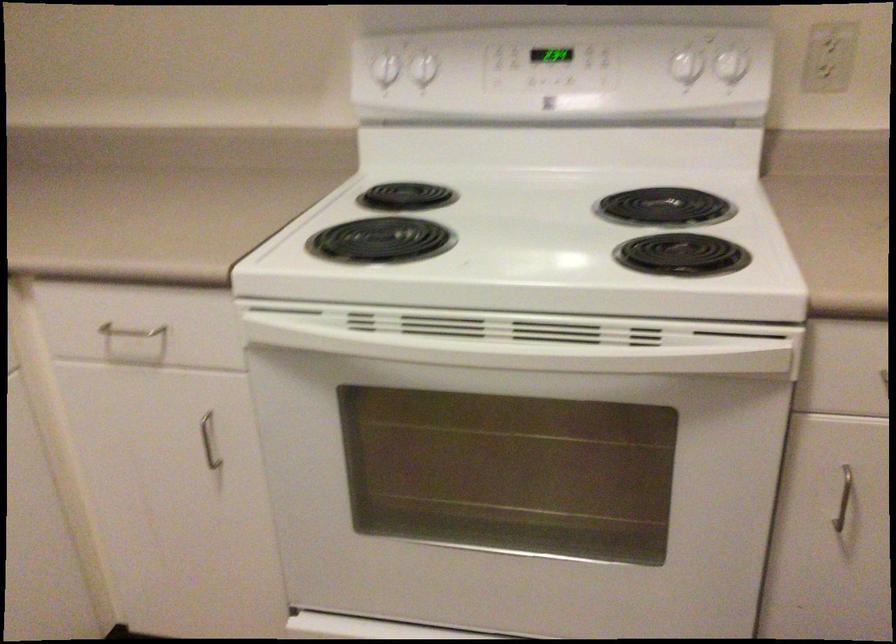
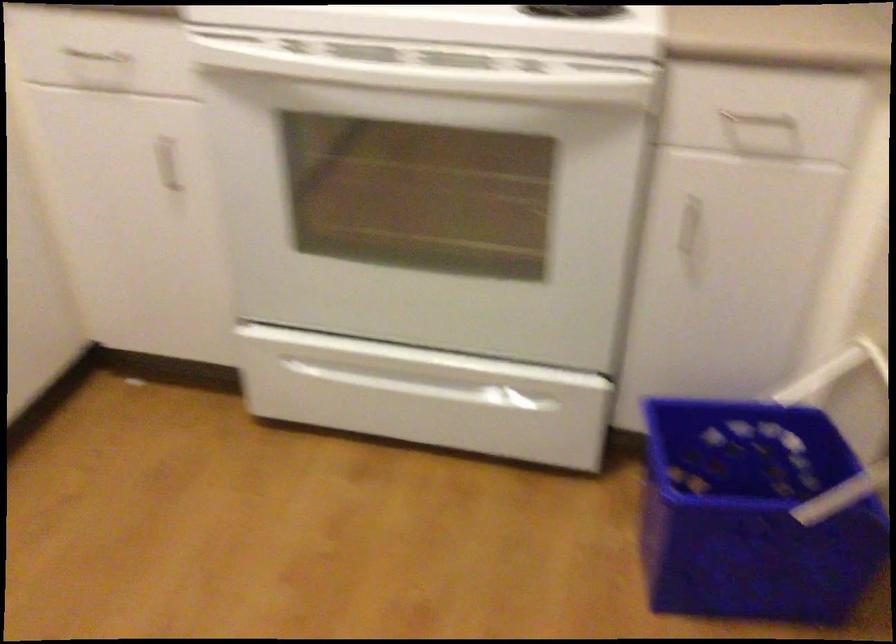
The point at (126, 317) is marked in the first image. Where is the corresponding point in the second image?

(97, 57)